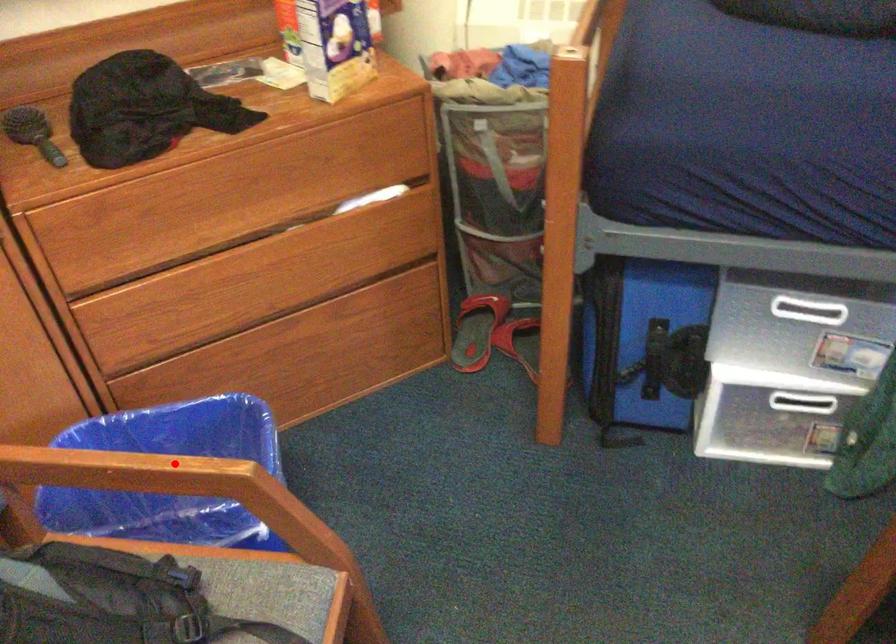
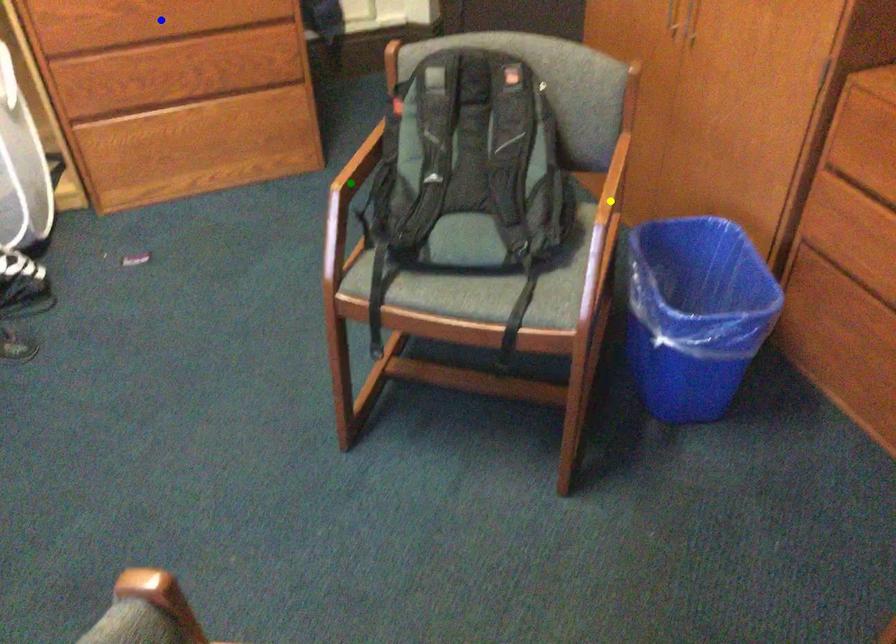
Question: I am providing you with two images of the same scene from different viewpoints. A red point is marked on the first image. You are given multiple points on the second image. Can you choose the point in image 2 that corresponds to the point in image 1?

Choices:
 (A) green point
 (B) blue point
 (C) yellow point

Answer: (C)